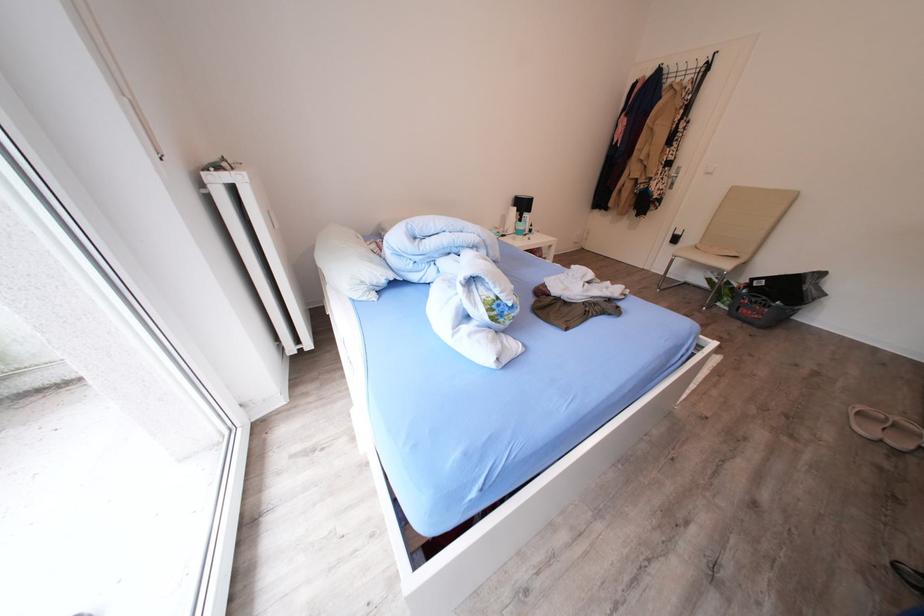
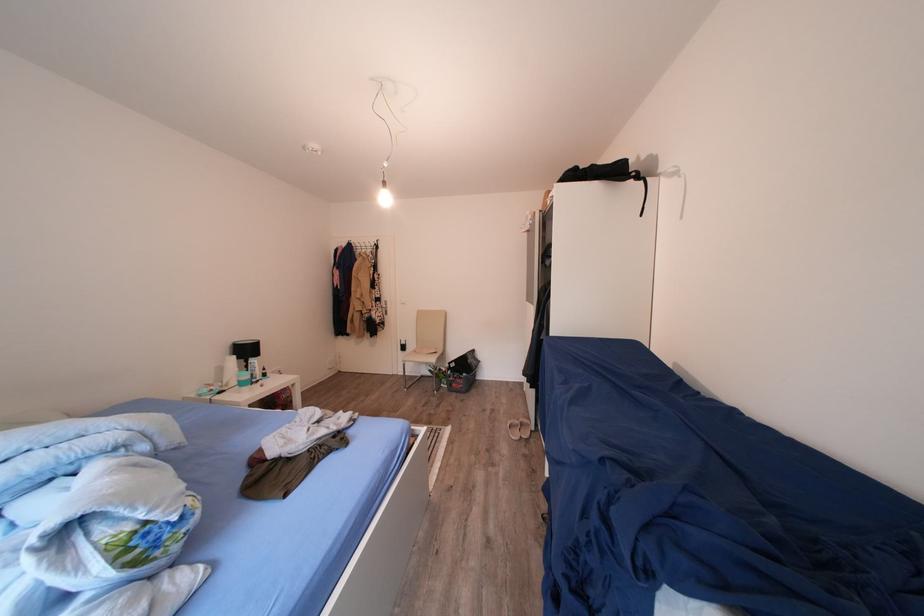
In the second image, find the point that corresponds to (685,245) in the first image.

(411, 353)